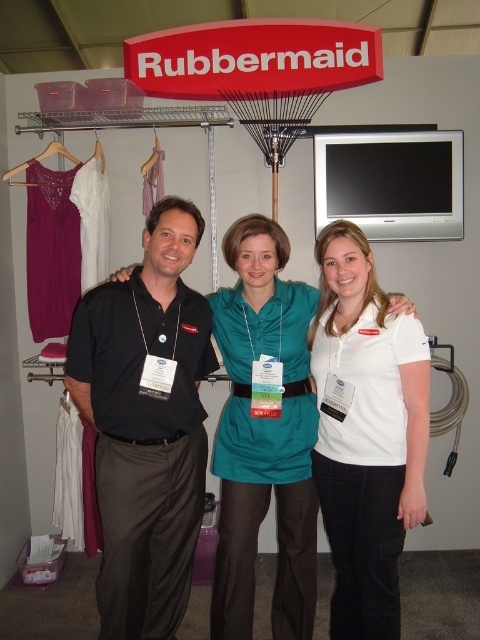
Question: From the image, what is the correct spatial relationship of white cotton polo shirt at center in relation to teal satin dress at center?

Choices:
 (A) left
 (B) right

Answer: (B)

Question: Which point is closer to the camera?

Choices:
 (A) (187, 442)
 (B) (288, 636)
 (C) (410, 502)

Answer: (C)

Question: Among these points, which one is nearest to the camera?

Choices:
 (A) (24, 166)
 (B) (134, 481)
 (C) (103, 172)
 (D) (214, 444)

Answer: (B)

Question: Does teal satin dress at center have a lesser width compared to white fabric hanger at upper left?

Choices:
 (A) yes
 (B) no

Answer: (B)

Question: Which point is closer to the camera?

Choices:
 (A) black smooth shirt at center
 (B) purple fabric hanger at left
 (C) white fabric hanger at upper left

Answer: (A)

Question: Does white cotton polo shirt at center appear on the left side of purple fabric hanger at left?

Choices:
 (A) no
 (B) yes

Answer: (A)